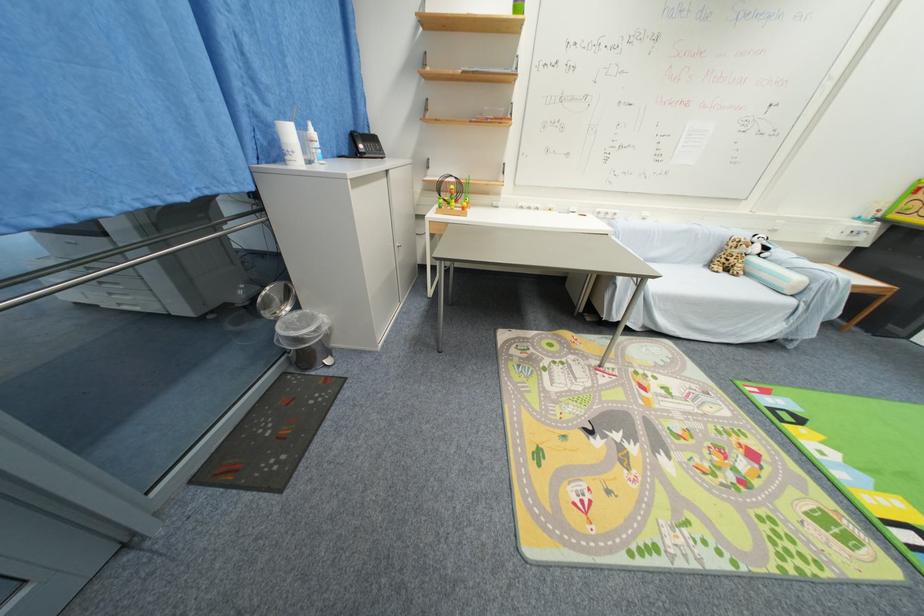
What do you see at coordinates (731, 256) in the screenshot? I see `the leopard stuffed animal` at bounding box center [731, 256].